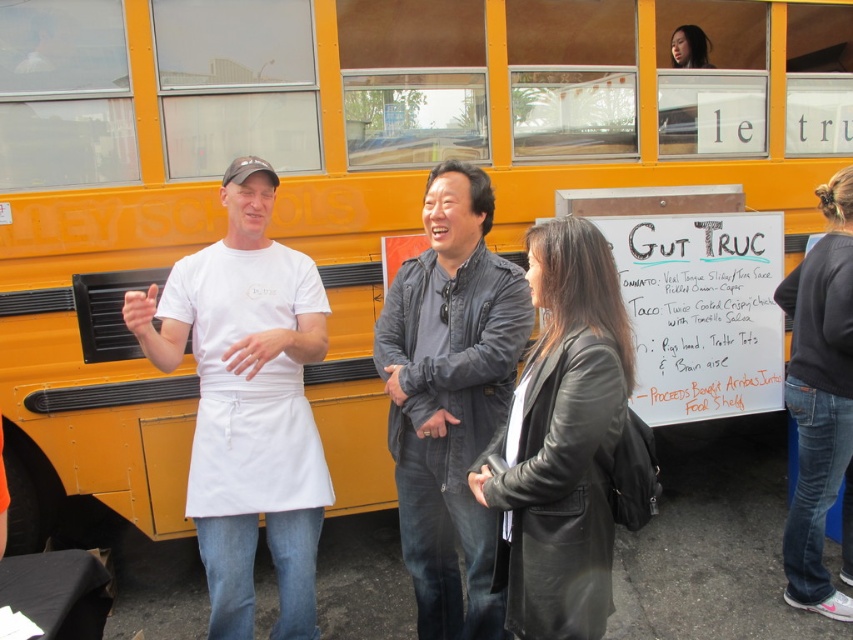
Can you confirm if white matte apron at center is positioned above black leather jacket at center?

Incorrect, white matte apron at center is not positioned above black leather jacket at center.

Which is in front, point (303, 465) or point (541, 580)?

Point (541, 580) is in front.

Where is `white matte apron at center`? white matte apron at center is located at coordinates (247, 403).

I want to click on white matte apron at center, so click(x=247, y=403).

Does dark gray leather jacket at center appear under dark gray sweater at lower right?

Yes, dark gray leather jacket at center is below dark gray sweater at lower right.

This screenshot has width=853, height=640. I want to click on dark gray leather jacket at center, so click(450, 397).

Who is more distant from viewer, (x=421, y=592) or (x=790, y=346)?

Positioned behind is point (x=790, y=346).

The width and height of the screenshot is (853, 640). In order to click on dark gray leather jacket at center in this screenshot , I will do `click(450, 397)`.

Who is shorter, white matte apron at center or dark gray leather jacket at center?

Standing shorter between the two is dark gray leather jacket at center.

Who is taller, white matte apron at center or dark gray leather jacket at center?

Standing taller between the two is white matte apron at center.

Image resolution: width=853 pixels, height=640 pixels. Identify the location of white matte apron at center. (247, 403).

Locate an element on the screen. white matte apron at center is located at coordinates (247, 403).